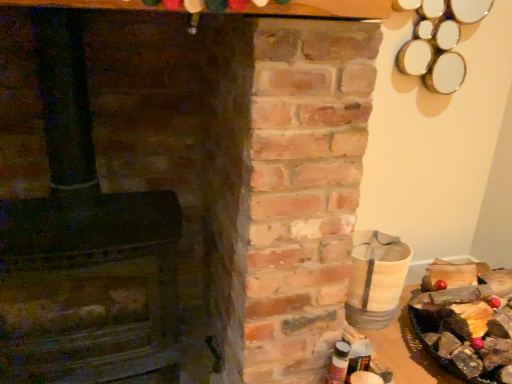
Question: In the image, is rustic brick fireplace at left positioned in front of or behind wooden log at right?

Choices:
 (A) front
 (B) behind

Answer: (A)

Question: From the image's perspective, is rustic brick fireplace at left located above or below wooden log at right?

Choices:
 (A) above
 (B) below

Answer: (A)

Question: From a real-world perspective, is rustic brick fireplace at left positioned above or below wooden log at right?

Choices:
 (A) above
 (B) below

Answer: (A)

Question: In terms of width, does wooden log at right look wider or thinner when compared to rustic brick fireplace at left?

Choices:
 (A) wide
 (B) thin

Answer: (A)

Question: Is wooden log at right spatially inside rustic brick fireplace at left, or outside of it?

Choices:
 (A) inside
 (B) outside

Answer: (B)

Question: Does point (490, 370) appear closer or farther from the camera than point (110, 286)?

Choices:
 (A) closer
 (B) farther

Answer: (B)

Question: Is wooden log at right bigger or smaller than rustic brick fireplace at left?

Choices:
 (A) small
 (B) big

Answer: (A)